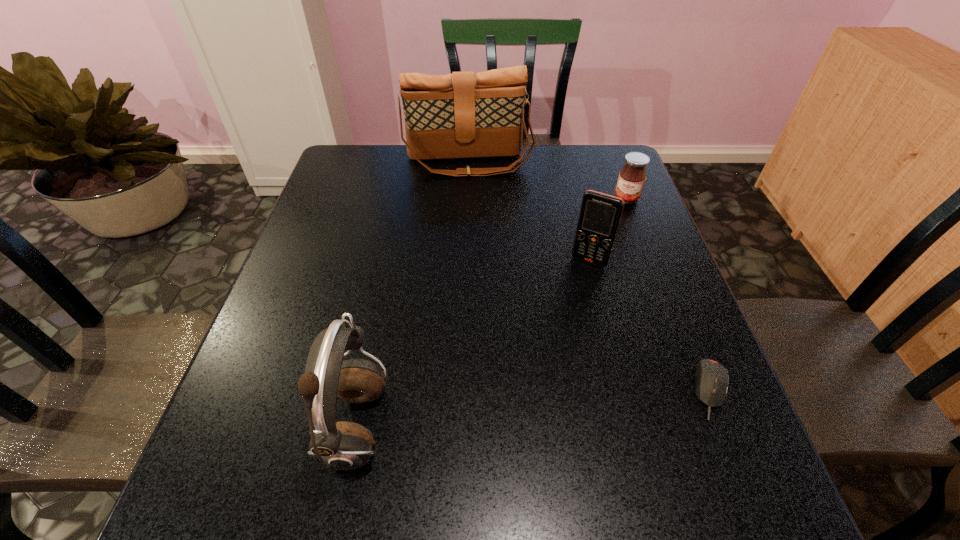
Identify the location of free space on the desktop that is between the earphone and the computer mouse and is positioned on the label side of the fourth tallest object. The width and height of the screenshot is (960, 540). pos(542,408).

Locate an element on the screen. This screenshot has height=540, width=960. vacant space on the desktop that is between the earphone and the computer mouse and is positioned on the front-facing side of the farthest object is located at coordinates (497, 413).

The width and height of the screenshot is (960, 540). I want to click on free space on the desktop that is between the earphone and the shortest object and is positioned on the screen of the third nearest object, so click(515, 411).